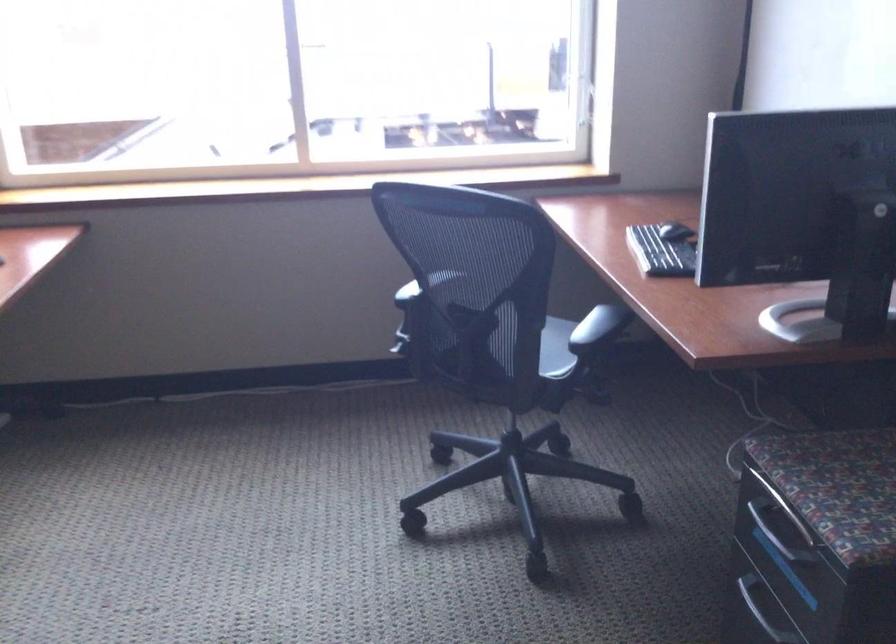
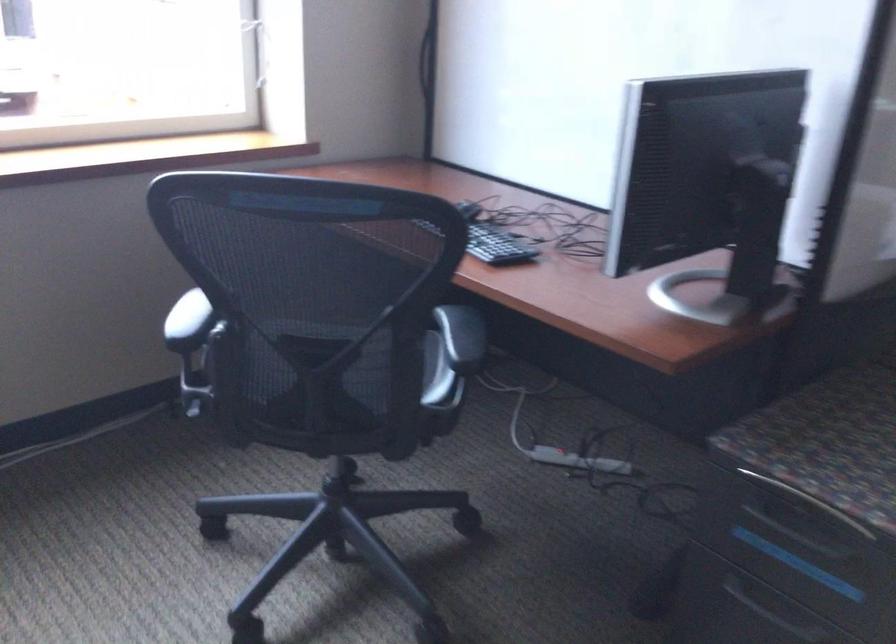
Where in the second image is the point corresponding to (x=582, y=355) from the first image?

(435, 373)